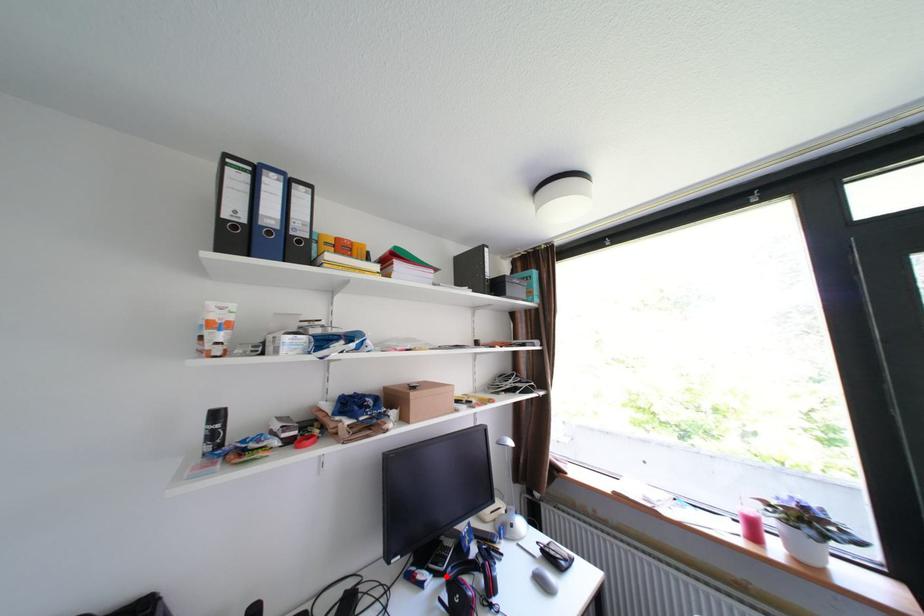
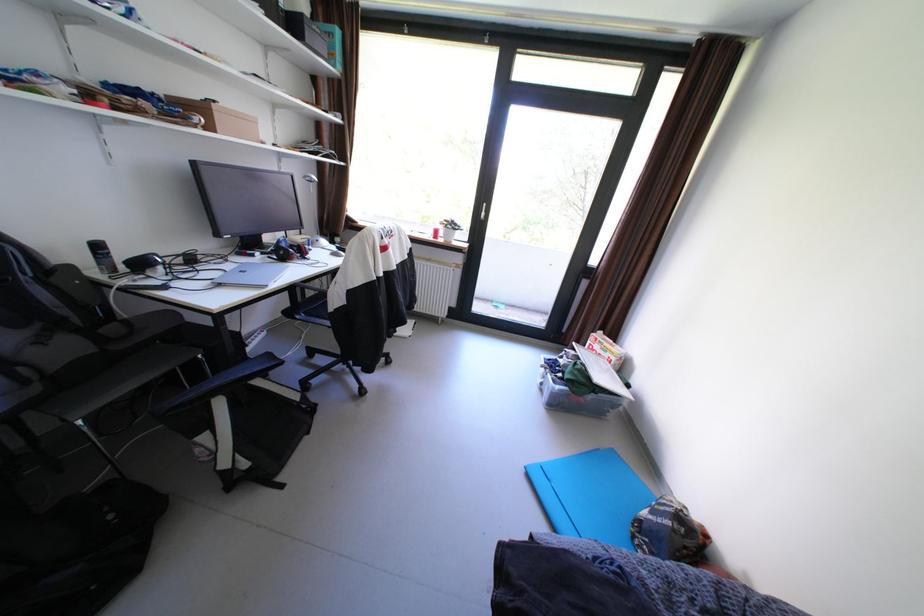
Where in the second image is the point corresponding to the highlighted location from the first image?

(274, 254)